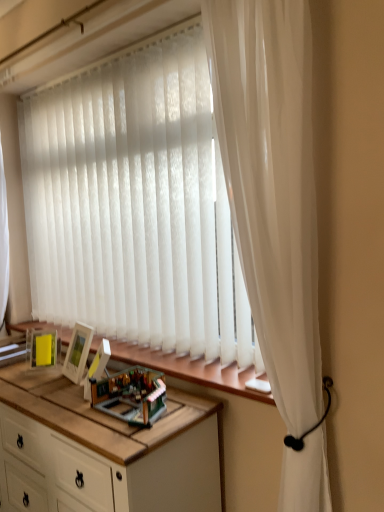
Question: Is white wood cabinet at center at the left side of translucent plastic toy at center?

Choices:
 (A) yes
 (B) no

Answer: (A)

Question: Is white wood cabinet at center beside translucent plastic toy at center?

Choices:
 (A) no
 (B) yes

Answer: (A)

Question: Is white wood cabinet at center outside translucent plastic toy at center?

Choices:
 (A) yes
 (B) no

Answer: (A)

Question: Is white wood cabinet at center taller than translucent plastic toy at center?

Choices:
 (A) yes
 (B) no

Answer: (A)

Question: Is white wood cabinet at center facing towards translucent plastic toy at center?

Choices:
 (A) yes
 (B) no

Answer: (B)

Question: Is white wood cabinet at center wider than translucent plastic toy at center?

Choices:
 (A) yes
 (B) no

Answer: (A)

Question: Is the surface of white sheer curtain at right in direct contact with wooden at lower center?

Choices:
 (A) yes
 (B) no

Answer: (B)

Question: Is white sheer curtain at right to the left of wooden at lower center from the viewer's perspective?

Choices:
 (A) yes
 (B) no

Answer: (B)

Question: Could you tell me if white sheer curtain at right is facing wooden at lower center?

Choices:
 (A) yes
 (B) no

Answer: (B)

Question: Is wooden at lower center surrounded by white sheer curtain at right?

Choices:
 (A) yes
 (B) no

Answer: (B)

Question: From the image's perspective, is white sheer curtain at right over wooden at lower center?

Choices:
 (A) yes
 (B) no

Answer: (A)

Question: Is white sheer curtain at right far from wooden at lower center?

Choices:
 (A) yes
 (B) no

Answer: (B)

Question: Is white sheer curtain at right in front of translucent plastic toy at center?

Choices:
 (A) no
 (B) yes

Answer: (B)